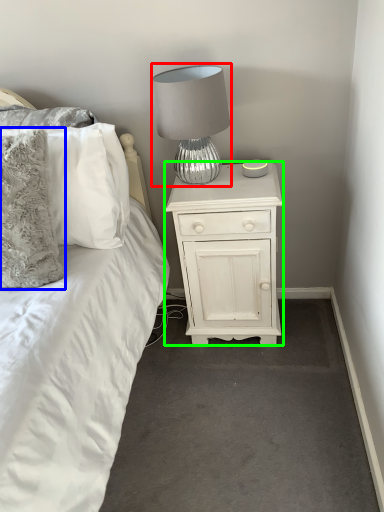
Question: Which is nearer to the lamp (highlighted by a red box)? pillow (highlighted by a blue box) or nightstand (highlighted by a green box).

Choices:
 (A) pillow
 (B) nightstand

Answer: (B)